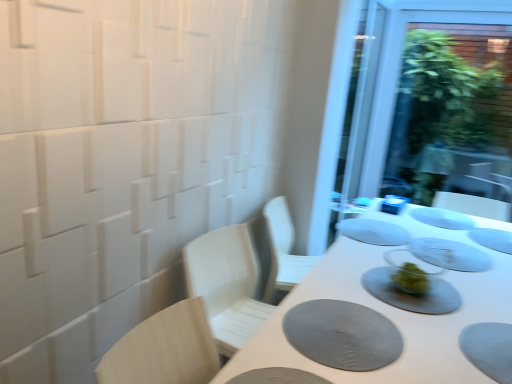
This screenshot has height=384, width=512. I want to click on vacant space situated on the left part of matte gray placemat at center, which is counted as the sixth tableware, starting from the back, so click(x=335, y=279).